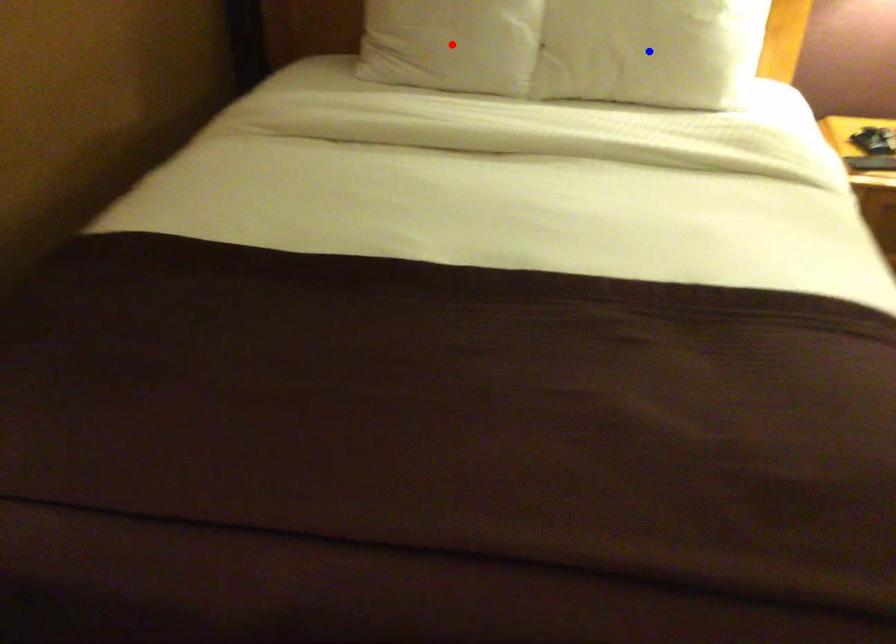
Question: In the image, two points are highlighted. Which point is nearer to the camera? Reply with the corresponding letter.

Choices:
 (A) blue point
 (B) red point

Answer: (A)